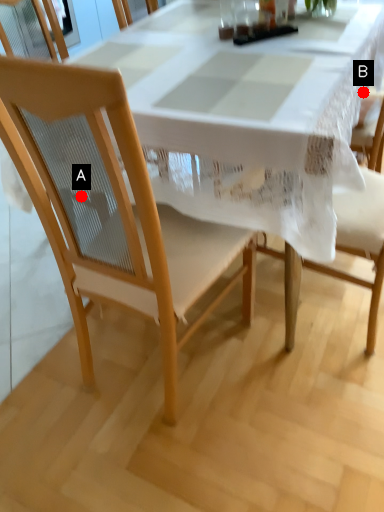
Question: Two points are circled on the image, labeled by A and B beside each circle. Which of the following is the farthest from the observer?

Choices:
 (A) A is further
 (B) B is further

Answer: (B)